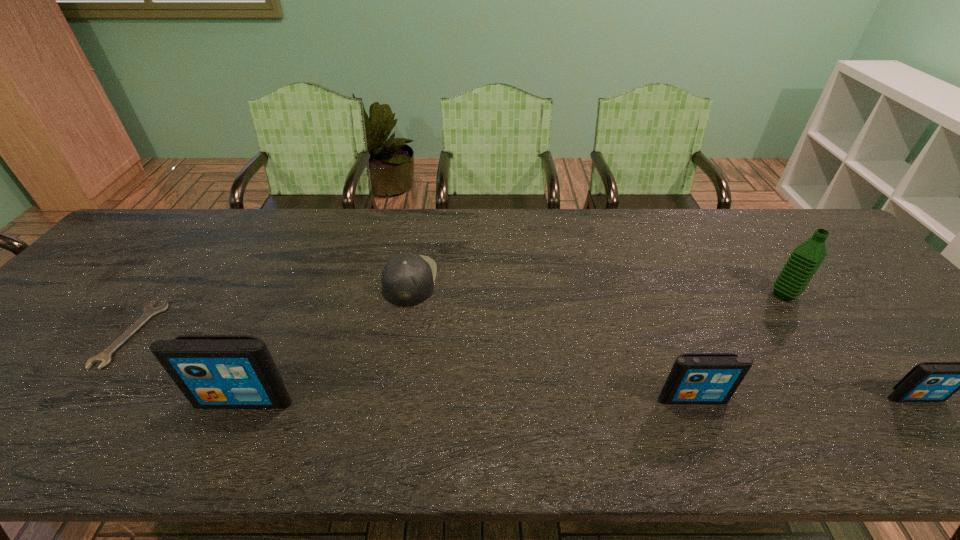
You are a GUI agent. You are given a task and a screenshot of the screen. Output one action in this format:
    pyautogui.click(x=<x>, y=<y>)
    Task: Click on the location for an additional iPod to make spacing equal
    Image resolution: width=960 pixels, height=540 pixels.
    Given the screenshot: What is the action you would take?
    pyautogui.click(x=468, y=400)